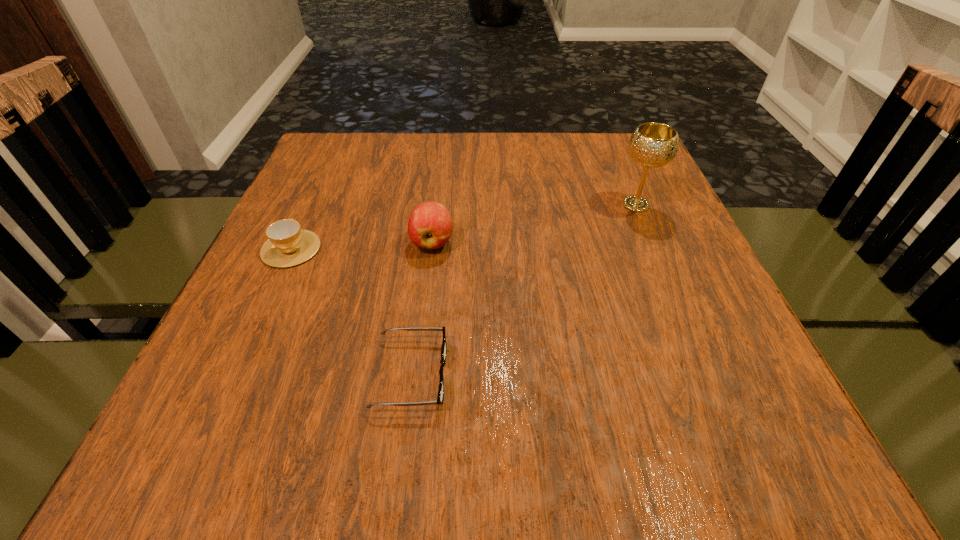
Locate an element on the screen. vacant space situated 0.260m with the handle on the side of the second shortest object is located at coordinates (329, 165).

Identify the location of vacant region located 0.230m with the handle on the side of the second shortest object. This screenshot has width=960, height=540. (326, 171).

Image resolution: width=960 pixels, height=540 pixels. I want to click on vacant point located on the front-facing side of the spectacles, so click(x=703, y=374).

The width and height of the screenshot is (960, 540). In order to click on object situated at the near edge in this screenshot , I will do [x=440, y=397].

Identify the location of object that is at the left edge. (288, 245).

Image resolution: width=960 pixels, height=540 pixels. I want to click on object present at the right edge, so click(652, 145).

In the image, there is a desktop. Where is `vacant space at the far edge`? This screenshot has width=960, height=540. vacant space at the far edge is located at coordinates (426, 164).

Where is `free space at the near edge of the desktop`? The image size is (960, 540). free space at the near edge of the desktop is located at coordinates (455, 417).

You are a GUI agent. You are given a task and a screenshot of the screen. Output one action in this format:
    pyautogui.click(x=<x>, y=<y>)
    Task: Click on the free space at the left edge
    
    Given the screenshot: What is the action you would take?
    pyautogui.click(x=363, y=190)

Where is `vacant space at the right edge of the desktop`? The width and height of the screenshot is (960, 540). vacant space at the right edge of the desktop is located at coordinates (653, 263).